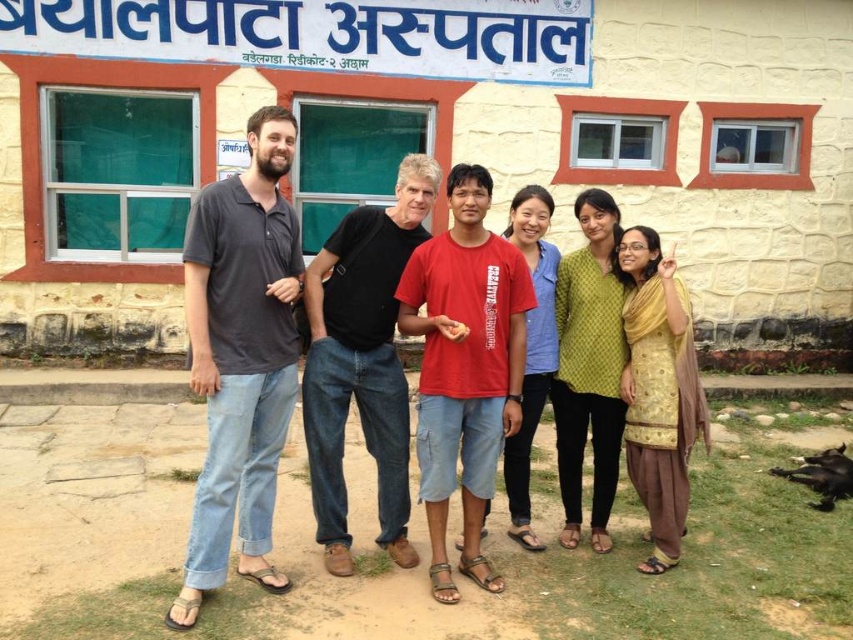
Does point (283, 234) come farther from viewer compared to point (640, 484)?

No, (283, 234) is in front of (640, 484).

Is gray cotton polo shirt at left in front of yellow embroidered dress at center?

Yes, gray cotton polo shirt at left is in front of yellow embroidered dress at center.

Where is `gray cotton polo shirt at left`? gray cotton polo shirt at left is located at coordinates click(x=241, y=358).

Between gray cotton polo shirt at left and red cotton t-shirt at center, which one appears on the left side from the viewer's perspective?

gray cotton polo shirt at left

Is gray cotton polo shirt at left to the left of red cotton t-shirt at center from the viewer's perspective?

Indeed, gray cotton polo shirt at left is positioned on the left side of red cotton t-shirt at center.

The height and width of the screenshot is (640, 853). What do you see at coordinates (241, 358) in the screenshot? I see `gray cotton polo shirt at left` at bounding box center [241, 358].

Where is `gray cotton polo shirt at left`? The width and height of the screenshot is (853, 640). gray cotton polo shirt at left is located at coordinates (241, 358).

Does matte gray shirt at center appear under yellow embroidered dress at center?

Incorrect, matte gray shirt at center is not positioned below yellow embroidered dress at center.

Can you confirm if matte gray shirt at center is wider than yellow embroidered dress at center?

Yes.

Where is `matte gray shirt at center`? The width and height of the screenshot is (853, 640). matte gray shirt at center is located at coordinates (294, 369).